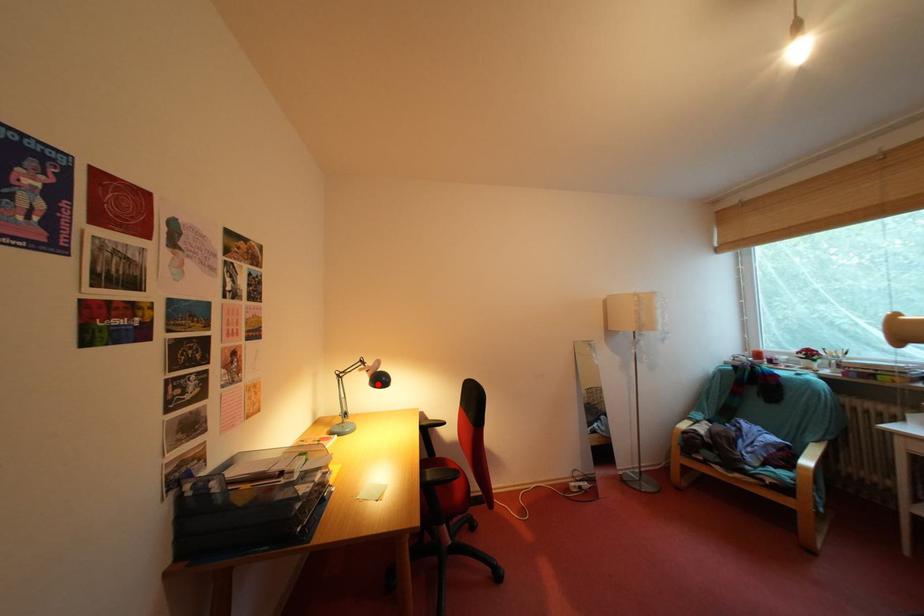
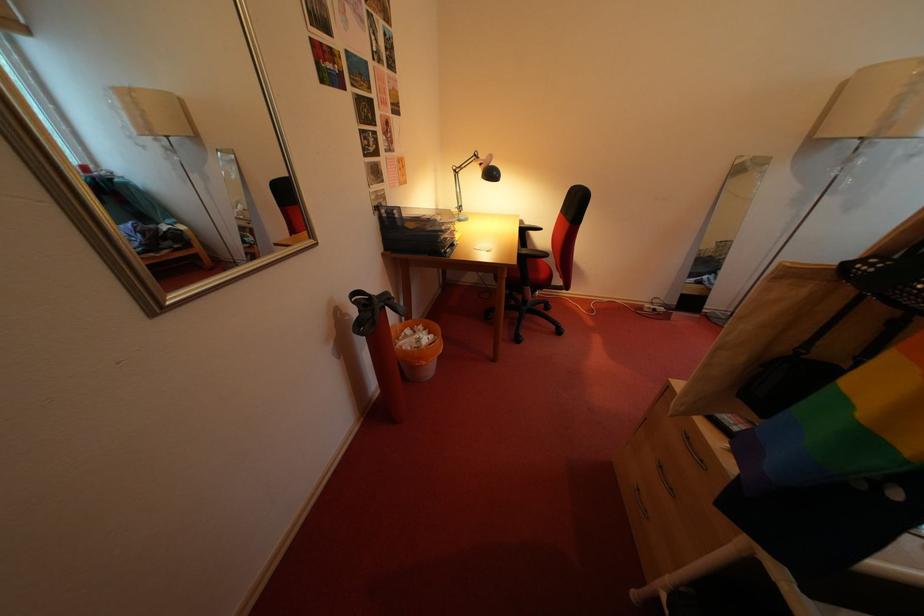
Question: I am providing you with two images of the same scene from different viewpoints. Given a red point in image1, look at the same physical point in image2. Is it:

Choices:
 (A) Closer to the viewpoint
 (B) Farther from the viewpoint

Answer: (A)